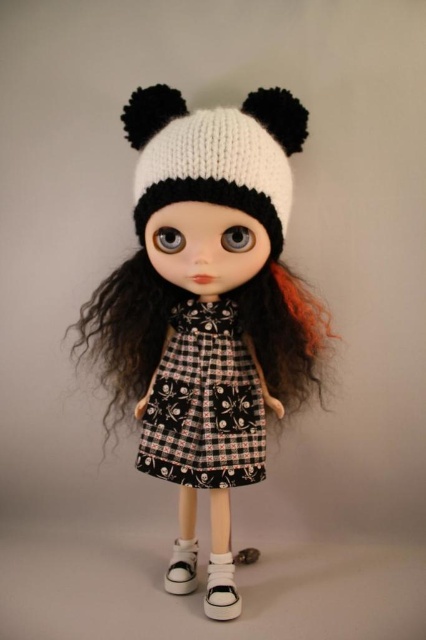
Is point (131, 312) positioned before point (181, 540)?

Yes, it is.

Who is taller, white knitted hat at center or white canvas shoe at lower center?

With more height is white knitted hat at center.

The image size is (426, 640). Find the location of `white knitted hat at center`. white knitted hat at center is located at coordinates (x=207, y=296).

Where is `white knitted hat at center`? The image size is (426, 640). white knitted hat at center is located at coordinates (207, 296).

Is curly hair at center below white matte shoe at lower center?

Actually, curly hair at center is above white matte shoe at lower center.

How much distance is there between curly hair at center and white matte shoe at lower center?

curly hair at center is 17.50 inches from white matte shoe at lower center.

Is point (141, 273) closer to viewer compared to point (207, 564)?

Yes, point (141, 273) is in front of point (207, 564).

The height and width of the screenshot is (640, 426). Identify the location of curly hair at center. (126, 330).

Who is taller, white knitted hat at upper center or white canvas shoe at lower center?

white knitted hat at upper center is taller.

Who is shorter, white knitted hat at upper center or white canvas shoe at lower center?

white canvas shoe at lower center is shorter.

The height and width of the screenshot is (640, 426). Find the location of `white knitted hat at upper center`. white knitted hat at upper center is located at coordinates (215, 154).